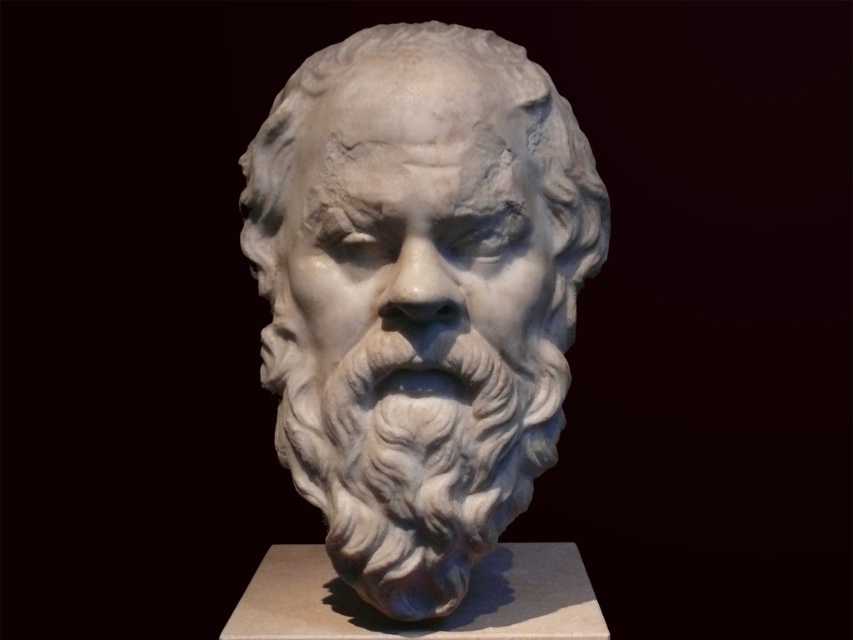
Question: Which point is farther from the camera taking this photo?

Choices:
 (A) (456, 262)
 (B) (364, 216)

Answer: (A)

Question: Which point appears closest to the camera in this image?

Choices:
 (A) (474, 179)
 (B) (503, 298)

Answer: (A)

Question: Can you confirm if white marble bust at center is thinner than white marble face at center?

Choices:
 (A) no
 (B) yes

Answer: (A)

Question: Is white marble bust at center closer to camera compared to white marble face at center?

Choices:
 (A) yes
 (B) no

Answer: (B)

Question: Does white marble bust at center have a larger size compared to white marble face at center?

Choices:
 (A) no
 (B) yes

Answer: (B)